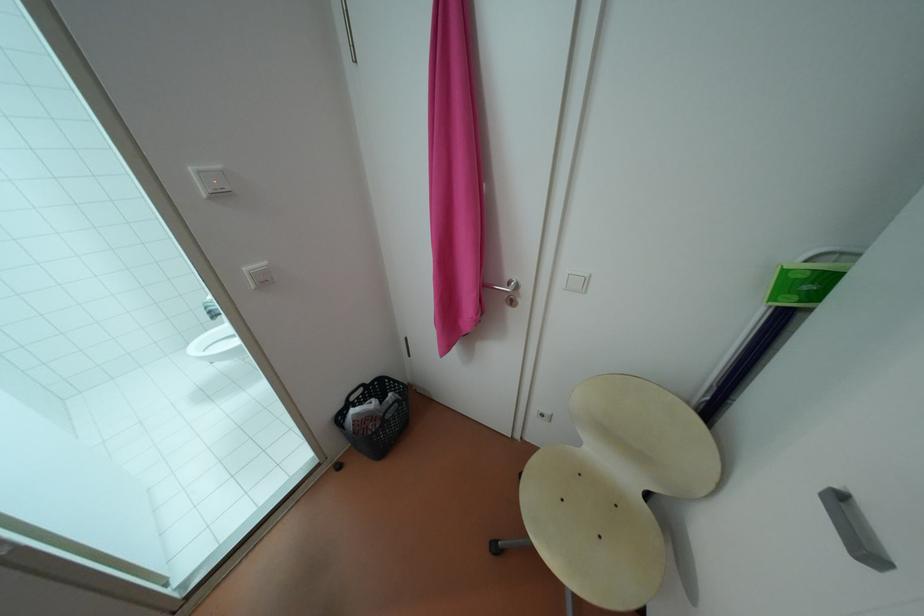
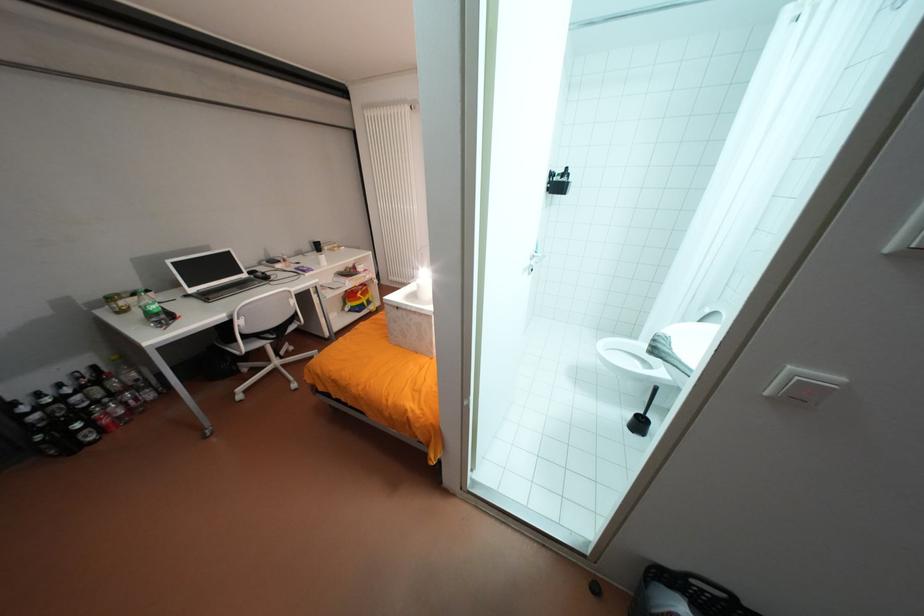
Find the pixel in the second image that matches (x=360, y=410) in the first image.

(694, 609)